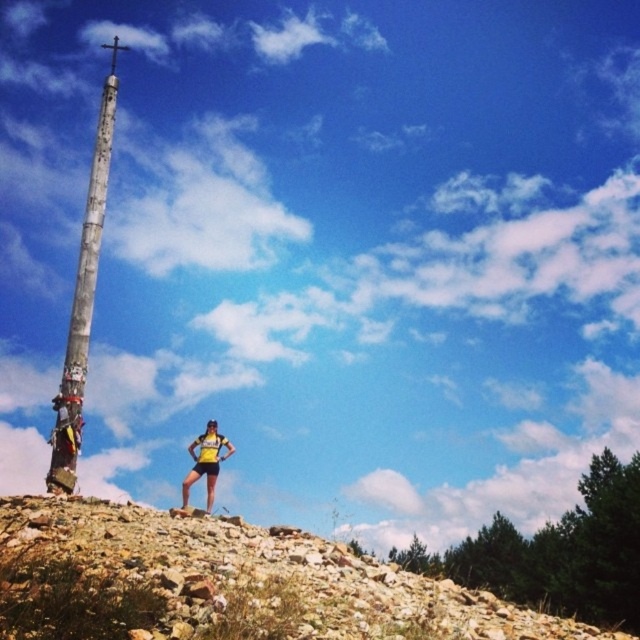
Which is more to the right, weathered wooden pole at left or yellow fabric shorts at center?

yellow fabric shorts at center

Which is behind, point (113, 81) or point (209, 483)?

The point (113, 81) is more distant.

Where is `weathered wooden pole at left`? This screenshot has width=640, height=640. weathered wooden pole at left is located at coordinates (83, 301).

Which of these two, brown rocky hillside at lower left or yellow fabric shorts at center, stands shorter?

Standing shorter between the two is yellow fabric shorts at center.

Between brown rocky hillside at lower left and yellow fabric shorts at center, which one is positioned lower?

Positioned lower is brown rocky hillside at lower left.

Does point (310, 589) come farther from viewer compared to point (228, 451)?

No, (310, 589) is in front of (228, 451).

Where is `brown rocky hillside at lower left`? brown rocky hillside at lower left is located at coordinates (224, 582).

Is brown rocky hillside at lower left thinner than weathered wooden pole at left?

Incorrect, brown rocky hillside at lower left's width is not less than weathered wooden pole at left's.

Which is in front, point (276, 630) or point (83, 236)?

Point (276, 630) is more forward.

Find the location of a particular element. The image size is (640, 640). brown rocky hillside at lower left is located at coordinates coord(224,582).